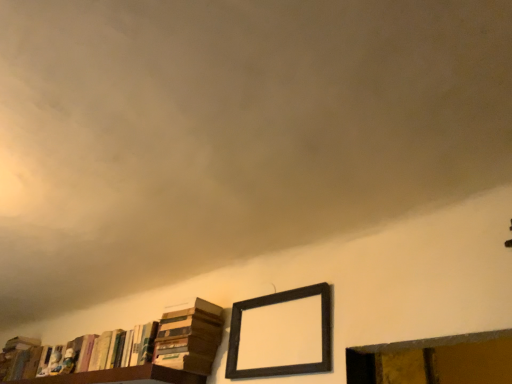
Question: Considering the relative positions of hardcover books at lower left, which is the second book from left to right, and dark wood picture frame at upper center in the image provided, is hardcover books at lower left, which is the second book from left to right, to the left or to the right of dark wood picture frame at upper center?

Choices:
 (A) right
 (B) left

Answer: (B)

Question: In terms of size, does hardcover books at lower left, the 2th book viewed from the right, appear bigger or smaller than dark wood picture frame at upper center?

Choices:
 (A) big
 (B) small

Answer: (A)

Question: Which object is the closest to the hardcover book at lower left, which appears as the third book when viewed from the right?

Choices:
 (A) dark wood picture frame at upper center
 (B) wooden window frame at lower right
 (C) hardcover books at lower left, marked as the 1th book in a right-to-left arrangement
 (D) hardcover books at lower left, the 2th book viewed from the right

Answer: (D)

Question: Which object is positioned farthest from the hardcover books at lower left, the 2th book viewed from the right?

Choices:
 (A) hardcover books at lower left, the 3th book positioned from the left
 (B) dark wood picture frame at upper center
 (C) wooden window frame at lower right
 (D) hardcover book at lower left, which ranks as the 1th book in left-to-right order

Answer: (C)